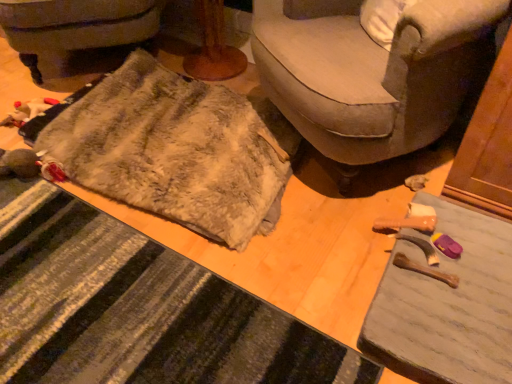
Question: Is fuzzy fabric doormat at lower left facing towards fuzzy fabric blanket at lower left?

Choices:
 (A) no
 (B) yes

Answer: (A)

Question: Is fuzzy fabric doormat at lower left to the left of fuzzy fabric blanket at lower left from the viewer's perspective?

Choices:
 (A) yes
 (B) no

Answer: (B)

Question: Is fuzzy fabric doormat at lower left not near fuzzy fabric blanket at lower left?

Choices:
 (A) yes
 (B) no

Answer: (A)

Question: Is fuzzy fabric blanket at lower left completely or partially inside fuzzy fabric doormat at lower left?

Choices:
 (A) no
 (B) yes

Answer: (A)

Question: From a real-world perspective, is fuzzy fabric doormat at lower left physically below fuzzy fabric blanket at lower left?

Choices:
 (A) yes
 (B) no

Answer: (A)

Question: From the image's perspective, is fuzzy beige blanket at lower left positioned above or below fuzzy fabric doormat at lower left?

Choices:
 (A) above
 (B) below

Answer: (A)

Question: In terms of height, does fuzzy beige blanket at lower left look taller or shorter compared to fuzzy fabric doormat at lower left?

Choices:
 (A) tall
 (B) short

Answer: (A)

Question: Visually, is fuzzy beige blanket at lower left positioned to the left or to the right of fuzzy fabric doormat at lower left?

Choices:
 (A) right
 (B) left

Answer: (A)

Question: Is fuzzy beige blanket at lower left inside the boundaries of fuzzy fabric doormat at lower left, or outside?

Choices:
 (A) inside
 (B) outside

Answer: (B)

Question: Is fuzzy fabric blanket at lower left taller or shorter than soft beige fabric couch at center?

Choices:
 (A) short
 (B) tall

Answer: (A)

Question: In the image, is fuzzy fabric blanket at lower left positioned in front of or behind soft beige fabric couch at center?

Choices:
 (A) front
 (B) behind

Answer: (B)

Question: In terms of width, does fuzzy fabric blanket at lower left look wider or thinner when compared to soft beige fabric couch at center?

Choices:
 (A) thin
 (B) wide

Answer: (A)

Question: From a real-world perspective, is fuzzy fabric blanket at lower left physically located above or below soft beige fabric couch at center?

Choices:
 (A) above
 (B) below

Answer: (B)

Question: Considering the positions of fuzzy fabric doormat at lower left and fuzzy beige blanket at lower left in the image, is fuzzy fabric doormat at lower left wider or thinner than fuzzy beige blanket at lower left?

Choices:
 (A) wide
 (B) thin

Answer: (B)

Question: From a real-world perspective, is fuzzy fabric doormat at lower left positioned above or below fuzzy beige blanket at lower left?

Choices:
 (A) above
 (B) below

Answer: (B)